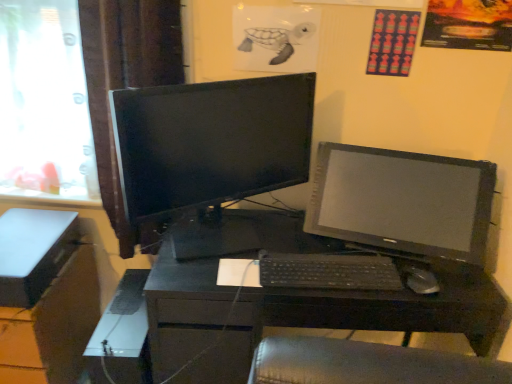
Find the location of a particular element. This screenshot has height=384, width=512. free space above white plastic computer tower at lower left (from a real-world perspective) is located at coordinates (123, 311).